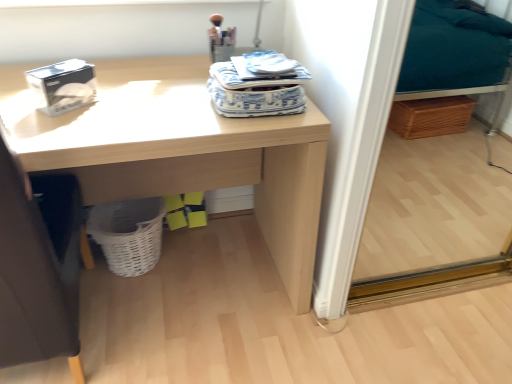
Question: Is yellow matte box at lower center, the first box in the bottom-to-top sequence, facing away from white matte tissue box at upper left, marked as the 2th box in a bottom-to-top arrangement?

Choices:
 (A) no
 (B) yes

Answer: (A)

Question: Is yellow matte box at lower center, which appears as the second box when viewed from the front, not inside white matte tissue box at upper left, which appears as the first box when viewed from the top?

Choices:
 (A) no
 (B) yes

Answer: (B)

Question: Does yellow matte box at lower center, the second box when ordered from left to right, have a smaller size compared to white matte tissue box at upper left, marked as the second box in a back-to-front arrangement?

Choices:
 (A) yes
 (B) no

Answer: (A)

Question: From the image's perspective, does yellow matte box at lower center, marked as the second box in a top-to-bottom arrangement, appear lower than white matte tissue box at upper left, the 1th box when ordered from front to back?

Choices:
 (A) yes
 (B) no

Answer: (A)

Question: Does yellow matte box at lower center, marked as the second box in a top-to-bottom arrangement, have a lesser height compared to white matte tissue box at upper left, positioned as the second box in right-to-left order?

Choices:
 (A) yes
 (B) no

Answer: (A)

Question: Considering their positions, is yellow matte box at lower center, which is the 1th box in right-to-left order, located in front of or behind white woven basket at lower left?

Choices:
 (A) front
 (B) behind

Answer: (B)

Question: Looking at the image, does yellow matte box at lower center, which is the 1th box in back-to-front order, seem bigger or smaller compared to white woven basket at lower left?

Choices:
 (A) small
 (B) big

Answer: (A)

Question: In terms of width, does yellow matte box at lower center, the first box in the bottom-to-top sequence, look wider or thinner when compared to white woven basket at lower left?

Choices:
 (A) thin
 (B) wide

Answer: (A)

Question: Considering the relative positions of yellow matte box at lower center, the second box when ordered from left to right, and white woven basket at lower left in the image provided, is yellow matte box at lower center, the second box when ordered from left to right, to the left or to the right of white woven basket at lower left?

Choices:
 (A) right
 (B) left

Answer: (A)

Question: Considering the relative positions of white matte tissue box at upper left, marked as the second box in a back-to-front arrangement, and yellow matte box at lower center, which appears as the second box when viewed from the front, in the image provided, is white matte tissue box at upper left, marked as the second box in a back-to-front arrangement, to the left or to the right of yellow matte box at lower center, which appears as the second box when viewed from the front,?

Choices:
 (A) right
 (B) left

Answer: (B)

Question: Looking at their shapes, would you say white matte tissue box at upper left, marked as the second box in a back-to-front arrangement, is wider or thinner than yellow matte box at lower center, which appears as the second box when viewed from the front?

Choices:
 (A) wide
 (B) thin

Answer: (A)

Question: Is white matte tissue box at upper left, marked as the 2th box in a bottom-to-top arrangement, spatially inside yellow matte box at lower center, which appears as the second box when viewed from the front, or outside of it?

Choices:
 (A) inside
 (B) outside

Answer: (B)

Question: Is white matte tissue box at upper left, the 1th box when ordered from front to back, in front of or behind yellow matte box at lower center, which is the 1th box in back-to-front order, in the image?

Choices:
 (A) behind
 (B) front

Answer: (B)

Question: Considering their positions, is white woven basket at lower left located in front of or behind dark gray fabric swivel chair at left?

Choices:
 (A) front
 (B) behind

Answer: (B)

Question: From a real-world perspective, is white woven basket at lower left above or below dark gray fabric swivel chair at left?

Choices:
 (A) above
 (B) below

Answer: (B)